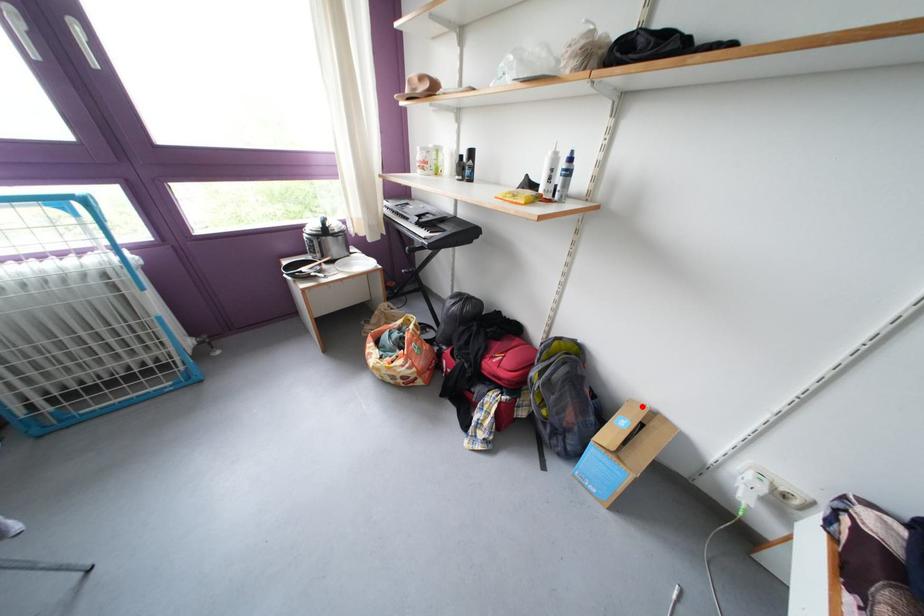
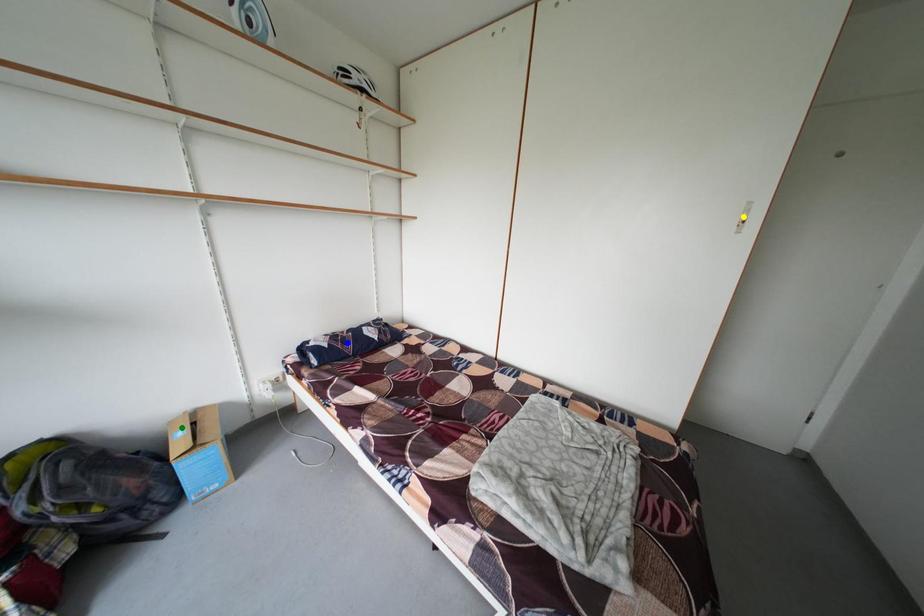
Question: I am providing you with two images of the same scene from different viewpoints. A red point is marked on the first image. You are given multiple points on the second image. Which point in image 2 represents the same 3d spot as the red point in image 1?

Choices:
 (A) yellow point
 (B) green point
 (C) blue point

Answer: (B)